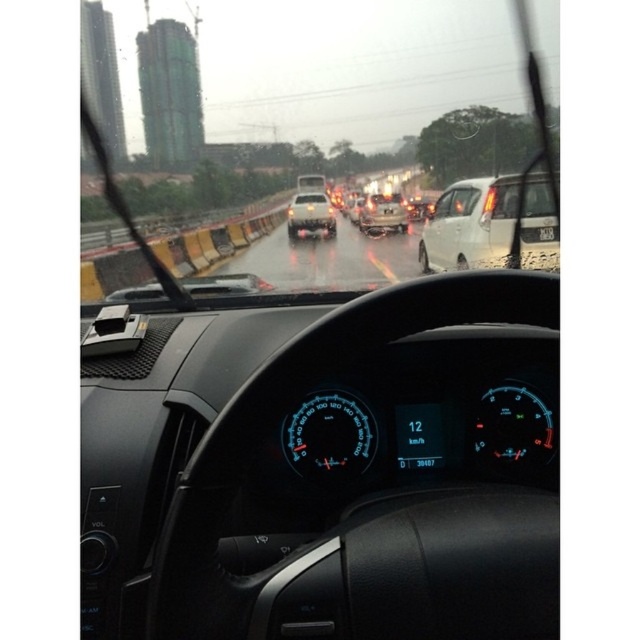
Question: Which point is closer to the camera?

Choices:
 (A) metallic silver sedan at center
 (B) white matte car at center

Answer: (B)

Question: Which point is closer to the camera?

Choices:
 (A) metallic silver suv at center
 (B) white matte car at center
 (C) transparent plastic speedometer at center

Answer: (C)

Question: Is metallic silver sedan at center below metallic silver suv at center?

Choices:
 (A) no
 (B) yes

Answer: (B)

Question: Can you confirm if transparent glass windshield at center is positioned above blue illuminated speedometer at center?

Choices:
 (A) yes
 (B) no

Answer: (A)

Question: Can you confirm if blue illuminated speedometer at center is smaller than metallic silver suv at center?

Choices:
 (A) no
 (B) yes

Answer: (B)

Question: Which object appears closest to the camera in this image?

Choices:
 (A) metallic silver suv at center
 (B) blue illuminated speedometer at center

Answer: (B)